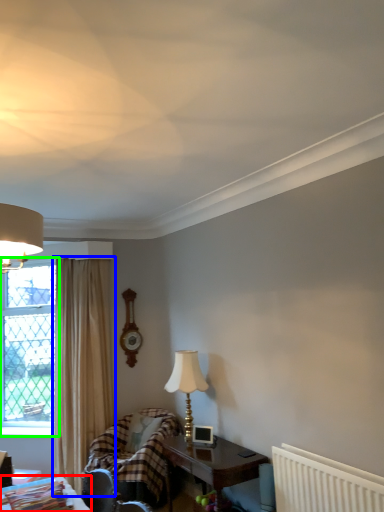
Question: Considering the real-world distances, which object is farthest from table (highlighted by a red box)? curtain (highlighted by a blue box) or window (highlighted by a green box)?

Choices:
 (A) curtain
 (B) window

Answer: (B)